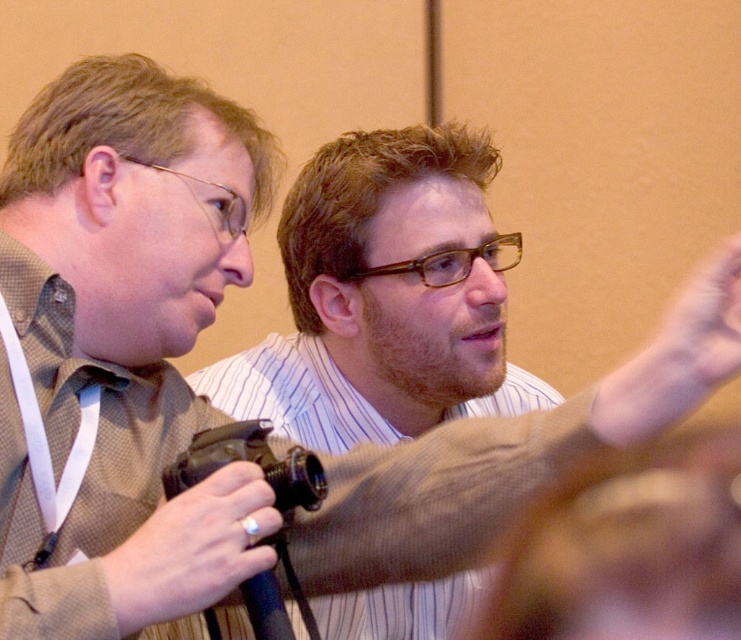
Consider the image. You are a fashion designer analyzing the image. You need to determine which accessory is shorter between the brown leather belt at center and the silver metallic ring at lower left. Which one is shorter?

The brown leather belt at center has a lesser height compared to the silver metallic ring at lower left, so the brown leather belt at center is shorter.

You are a photographer trying to decide which item to place in your equipment bag first. The matte brown camera at left and the silver metallic ring at lower left are both in sight. Based on their sizes, which item should you pick up first to ensure it fits properly?

The matte brown camera at left has a larger size compared to the silver metallic ring at lower left, so you should pick up the matte brown camera at left first to ensure there is enough space for it in the bag.

You are a photographer in the scene and need to adjust your equipment. You see the brown leather belt at center and the silver metallic ring at lower left. Which object is located higher in the image?

The brown leather belt at center is above the silver metallic ring at lower left, so it is located higher in the image.